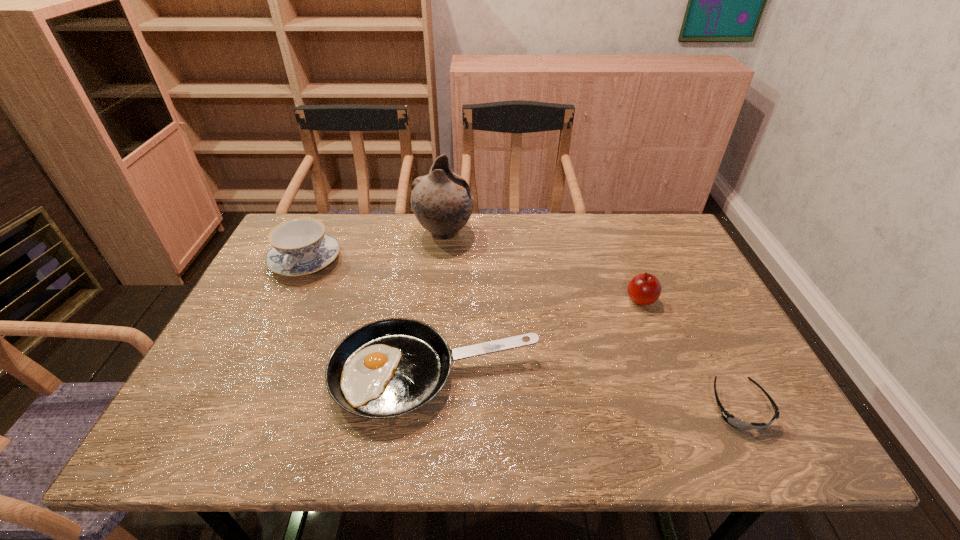
You are a GUI agent. You are given a task and a screenshot of the screen. Output one action in this format:
    pyautogui.click(x=<x>, y=<y>)
    Task: Click on the free space in the image that satisfies the following two spatial constraints: 1. with the handle on the side of the second object from right to left; 2. on the left side of the leftmost object
    
    Given the screenshot: What is the action you would take?
    pyautogui.click(x=287, y=300)